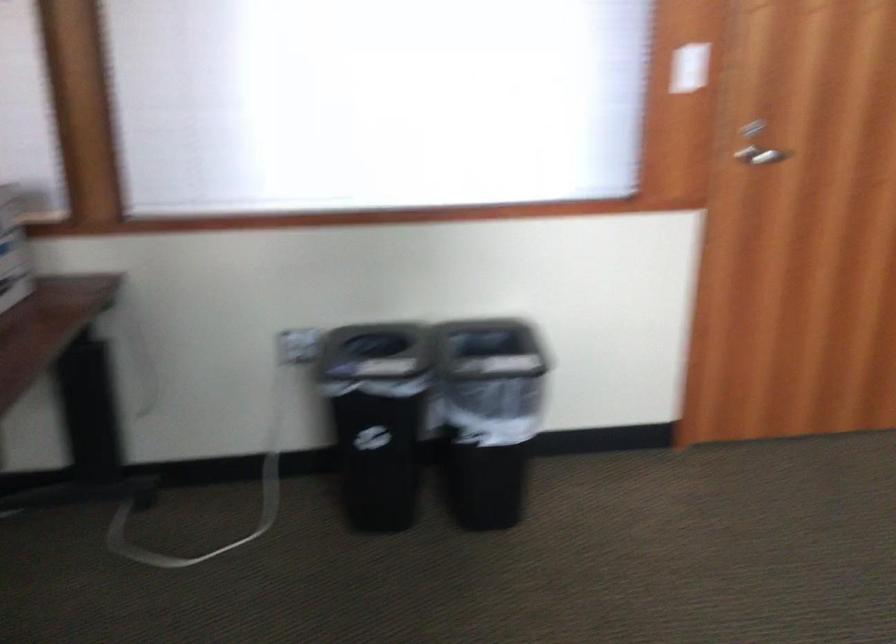
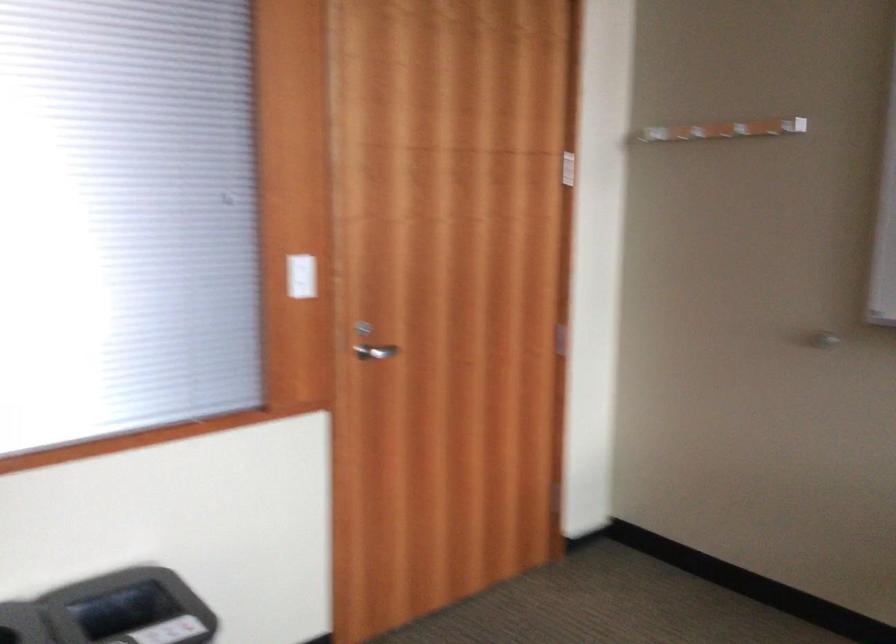
Locate, in the second image, the point that corresponds to point (677, 70) in the first image.

(300, 276)